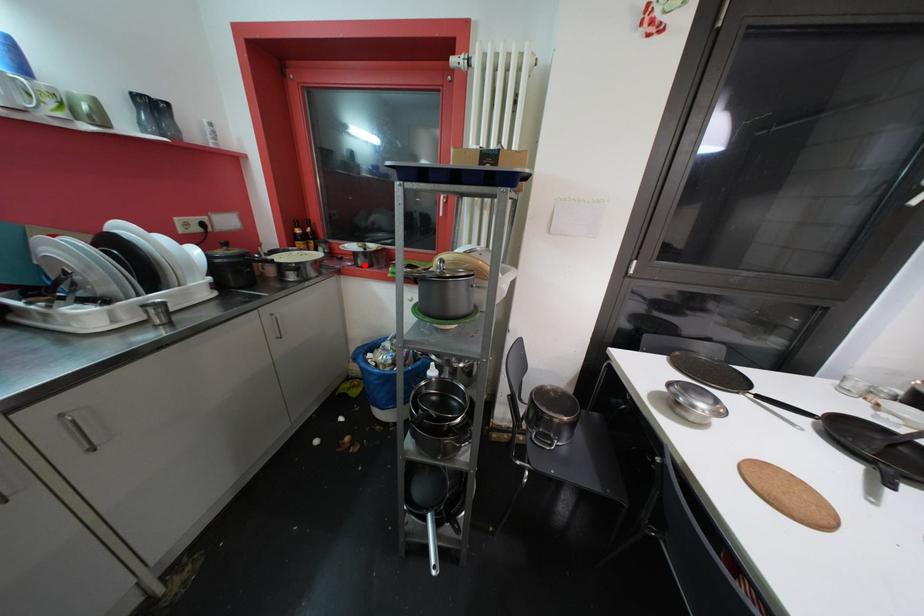
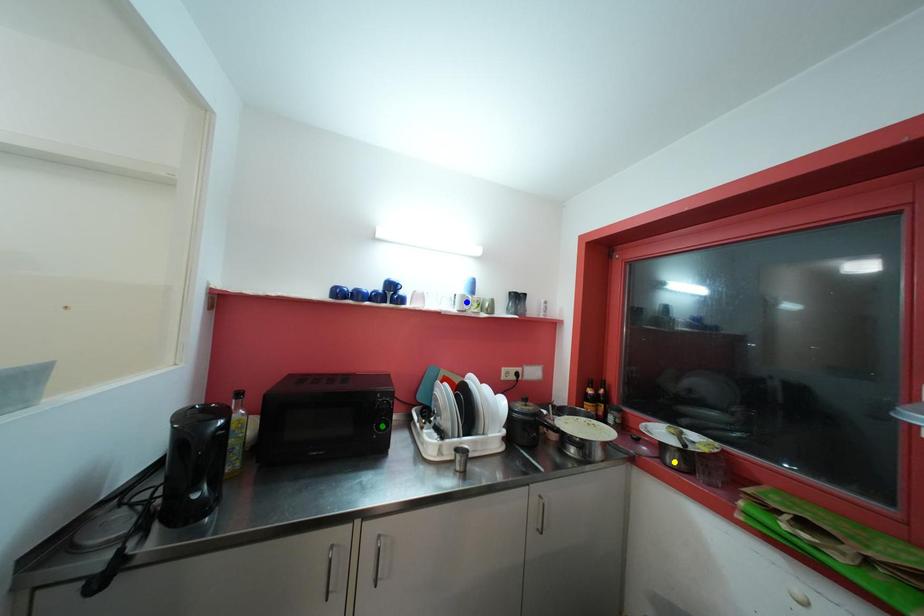
Question: I am providing you with two images of the same scene from different viewpoints. A red point is marked on the first image. You are given multiple points on the second image. Which spot in image 2 lines up with the point in image 1?

Choices:
 (A) yellow point
 (B) green point
 (C) blue point

Answer: (A)